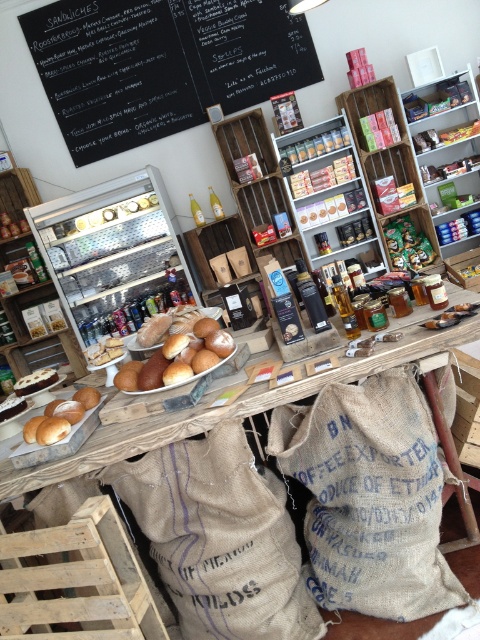
Question: Considering the real-world distances, which object is closest to the white cake at center?

Choices:
 (A) brown matte bread rolls at center
 (B) wooden table at center

Answer: (A)

Question: Is black chalkboard at upper center thinner than burlap sack at lower center?

Choices:
 (A) no
 (B) yes

Answer: (A)

Question: Which object is closer to the camera taking this photo?

Choices:
 (A) wooden table at center
 (B) brown matte bread rolls at center

Answer: (A)

Question: Which object appears closest to the camera in this image?

Choices:
 (A) white cake at center
 (B) shiny metallic canisters at center
 (C) brown matte bread rolls at center

Answer: (C)

Question: Where is burlap sack at lower center located in relation to brown matte bread rolls at center in the image?

Choices:
 (A) below
 (B) above

Answer: (A)

Question: Is brown matte bread rolls at center above white cake at center?

Choices:
 (A) no
 (B) yes

Answer: (B)